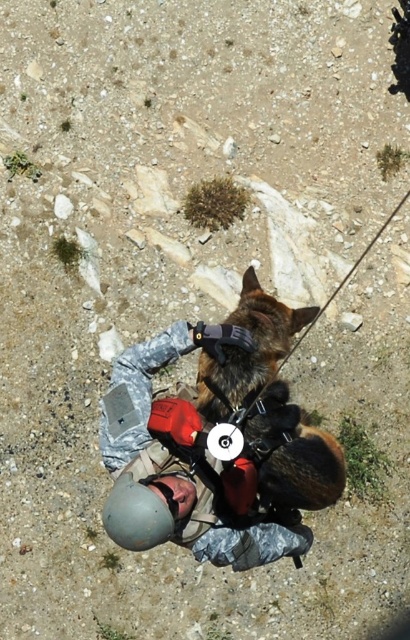
The height and width of the screenshot is (640, 410). Find the location of `camouflage uniform at center`. camouflage uniform at center is located at coordinates (138, 428).

Measure the distance from camouflage uniform at center to gray matte helmet at lower center.

9.86 inches

Does point (214, 333) lie behind point (107, 525)?

Yes, point (214, 333) is farther from viewer.

At what (x,y) coordinates should I click in order to perform the action: click on camouflage uniform at center. Please return your answer as a coordinate pair (x, y). The height and width of the screenshot is (640, 410). Looking at the image, I should click on (138, 428).